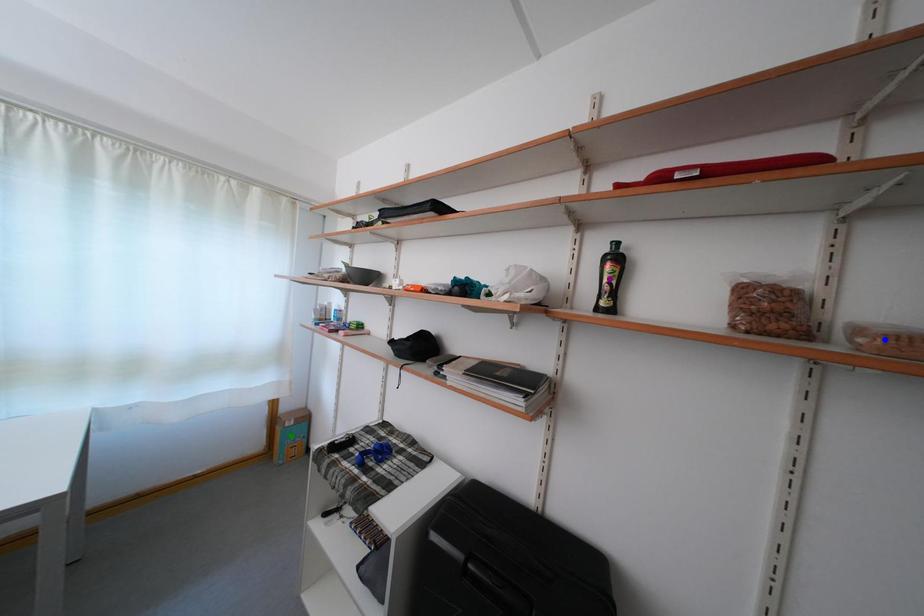
Order these from nearest to farthest:
blue point, green point, purple point

1. blue point
2. purple point
3. green point